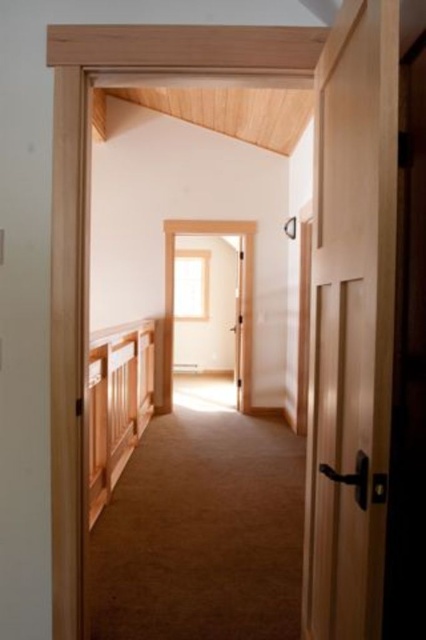
From the picture: Who is positioned more to the right, light brown wooden door at right or wooden textured rail at left?

light brown wooden door at right

The height and width of the screenshot is (640, 426). Find the location of `light brown wooden door at right`. light brown wooden door at right is located at coordinates (351, 323).

Identify the location of light brown wooden door at right. (351, 323).

At what (x,y) coordinates should I click in order to perform the action: click on light brown wooden door at right. Please return your answer as a coordinate pair (x, y). Looking at the image, I should click on (351, 323).